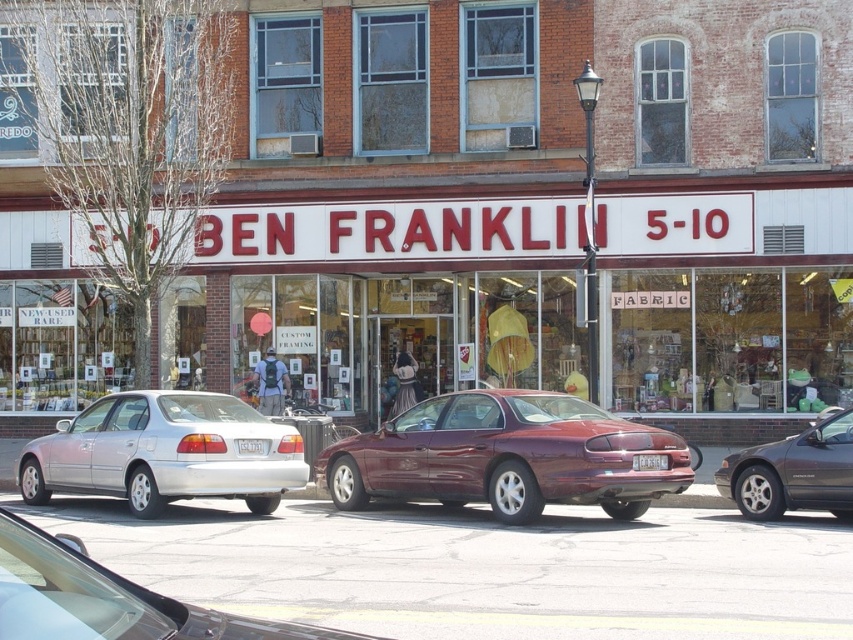
Question: Is matte white sign at center below maroon metallic sedan at center?

Choices:
 (A) yes
 (B) no

Answer: (B)

Question: Is matte white sign at center further to camera compared to metallic gray sedan at right?

Choices:
 (A) no
 (B) yes

Answer: (B)

Question: Which object appears farthest from the camera in this image?

Choices:
 (A) silver metallic sedan at center
 (B) metallic gray sedan at right
 (C) matte white sign at center
 (D) maroon metallic sedan at center

Answer: (C)

Question: Which point appears closest to the camera in this image?

Choices:
 (A) (83, 333)
 (B) (753, 500)

Answer: (B)

Question: Which object is the farthest from the maroon metallic sedan at center?

Choices:
 (A) metallic gray sedan at right
 (B) silver metallic sedan at center
 (C) silver metallic sedan at left
 (D) matte white sign at center

Answer: (B)

Question: Can you confirm if maroon metallic sedan at center is thinner than metallic gray sedan at right?

Choices:
 (A) no
 (B) yes

Answer: (A)